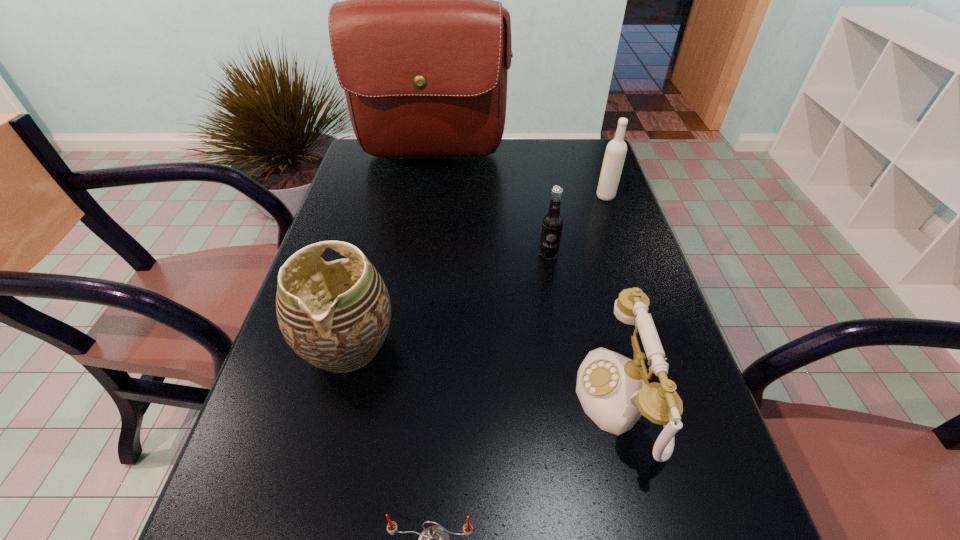
At what (x,y) coordinates should I click in order to perform the action: click on free location located on the dial of the telephone. Please return your answer as a coordinate pair (x, y). The image size is (960, 540). Looking at the image, I should click on (366, 400).

Image resolution: width=960 pixels, height=540 pixels. What are the coordinates of `vacant space located on the dial of the telephone` in the screenshot? It's located at (447, 400).

You are a GUI agent. You are given a task and a screenshot of the screen. Output one action in this format:
    pyautogui.click(x=<x>, y=<y>)
    Task: Click on the free space located on the dial of the telephone
    This screenshot has height=540, width=960.
    Given the screenshot: What is the action you would take?
    pyautogui.click(x=550, y=400)

The width and height of the screenshot is (960, 540). In order to click on object at the far edge in this screenshot , I will do `click(421, 48)`.

Identify the location of satchel present at the left edge. This screenshot has height=540, width=960. (421, 48).

Image resolution: width=960 pixels, height=540 pixels. Identify the location of pottery positioned at the left edge. (335, 315).

The height and width of the screenshot is (540, 960). In order to click on vodka that is at the right edge in this screenshot , I will do `click(616, 150)`.

What are the coordinates of `telephone present at the right edge` in the screenshot? It's located at (614, 392).

I want to click on object situated at the far left corner, so click(x=421, y=48).

Identify the location of free space at the far edge of the desktop. (476, 168).